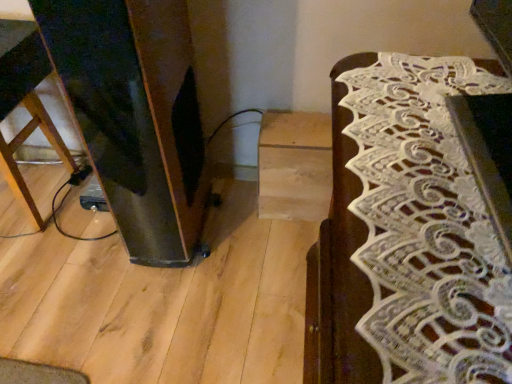
Question: From the image's perspective, is white lace table runner at right, which appears as the second furniture when viewed from the left, below wooden stool at left, arranged as the second furniture when viewed from the right?

Choices:
 (A) yes
 (B) no

Answer: (A)

Question: From a real-world perspective, does white lace table runner at right, which appears as the 1th furniture when viewed from the right, sit lower than wooden stool at left, which appears as the second furniture when viewed from the front?

Choices:
 (A) yes
 (B) no

Answer: (B)

Question: Is white lace table runner at right, which appears as the 1th furniture when viewed from the right, smaller than wooden stool at left, which is the first furniture in back-to-front order?

Choices:
 (A) no
 (B) yes

Answer: (B)

Question: Is white lace table runner at right, which appears as the 2th furniture when viewed from the back, at the left side of wooden stool at left, arranged as the second furniture when viewed from the right?

Choices:
 (A) no
 (B) yes

Answer: (A)

Question: Is white lace table runner at right, arranged as the first furniture when viewed from the front, to the right of wooden stool at left, arranged as the second furniture when viewed from the right, from the viewer's perspective?

Choices:
 (A) yes
 (B) no

Answer: (A)

Question: Considering the relative sizes of white lace table runner at right, which appears as the second furniture when viewed from the left, and wooden stool at left, which appears as the second furniture when viewed from the front, in the image provided, is white lace table runner at right, which appears as the second furniture when viewed from the left, shorter than wooden stool at left, which appears as the second furniture when viewed from the front,?

Choices:
 (A) yes
 (B) no

Answer: (A)

Question: Considering the relative sizes of wooden stool at left, placed as the first furniture when sorted from left to right, and white lace table runner at right, which appears as the 2th furniture when viewed from the back, in the image provided, is wooden stool at left, placed as the first furniture when sorted from left to right, thinner than white lace table runner at right, which appears as the 2th furniture when viewed from the back,?

Choices:
 (A) yes
 (B) no

Answer: (A)

Question: Is wooden stool at left, which appears as the second furniture when viewed from the front, touching white lace table runner at right, which appears as the 1th furniture when viewed from the right?

Choices:
 (A) no
 (B) yes

Answer: (A)

Question: Is wooden stool at left, which is the first furniture in back-to-front order, to the left of white lace table runner at right, which appears as the second furniture when viewed from the left, from the viewer's perspective?

Choices:
 (A) no
 (B) yes

Answer: (B)

Question: Is the position of wooden stool at left, which is the first furniture in back-to-front order, less distant than that of white lace table runner at right, which appears as the second furniture when viewed from the left?

Choices:
 (A) yes
 (B) no

Answer: (B)

Question: From a real-world perspective, is wooden stool at left, placed as the first furniture when sorted from left to right, over white lace table runner at right, which appears as the second furniture when viewed from the left?

Choices:
 (A) no
 (B) yes

Answer: (A)

Question: Are wooden stool at left, arranged as the second furniture when viewed from the right, and white lace table runner at right, which appears as the 1th furniture when viewed from the right, located far from each other?

Choices:
 (A) no
 (B) yes

Answer: (A)

Question: Considering the positions of point (25, 91) and point (330, 292), is point (25, 91) closer or farther from the camera than point (330, 292)?

Choices:
 (A) farther
 (B) closer

Answer: (A)